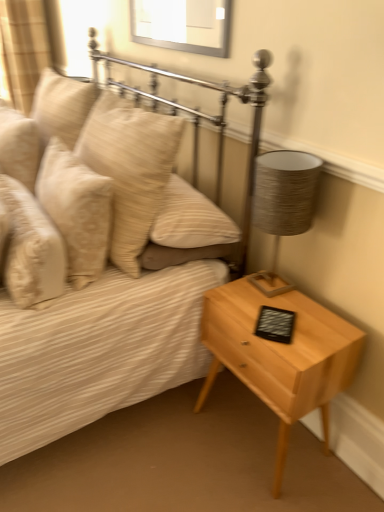
Find the location of a particular element. The image size is (384, 512). light wood/texture nightstand at lower right is located at coordinates (280, 355).

Identify the location of beige textured pillow at left, which ranks as the 3th pillow in left-to-right order. (76, 210).

Locate an element on the screen. matte beige bed at center is located at coordinates (106, 259).

Find the location of a particular element. beige textured pillow at left, the second pillow in the left-to-right sequence is located at coordinates (31, 249).

Image resolution: width=384 pixels, height=512 pixels. What do you see at coordinates (283, 205) in the screenshot? I see `textured gray lampshade at right` at bounding box center [283, 205].

Find the location of `beige fabric curtain at upper left`. beige fabric curtain at upper left is located at coordinates (23, 49).

Measure the distance between beige textured pillow at left, which is the fourth pillow in right-to-left order, and camera.

1.93 meters.

Identify the location of beige textured pillow at left, acting as the 1th pillow starting from the left. (19, 146).

In order to click on light wood/texture nightstand at lower right in this screenshot , I will do `click(280, 355)`.

Could you tell me if beige textured pillow at left, which is the fourth pillow in right-to-left order, is turned towards beige textured pillow at left, which ranks as the 3th pillow in left-to-right order?

No, beige textured pillow at left, which is the fourth pillow in right-to-left order, does not turn towards beige textured pillow at left, which ranks as the 3th pillow in left-to-right order.

From the image's perspective, which one is positioned higher, beige textured pillow at left, acting as the 1th pillow starting from the left, or beige textured pillow at left, which ranks as the 3th pillow in left-to-right order?

beige textured pillow at left, acting as the 1th pillow starting from the left, appears higher in the image.

Identify the location of the 1st pillow above the beige textured pillow at left, which is the second pillow from right to left (from a real-world perspective). pos(19,146).

Which point is more distant from viewer, (2, 143) or (69, 225)?

The point (2, 143) is farther from the camera.

Is beige textured pillow at left, which is the fourth pillow in right-to-left order, oriented away from beige fabric curtain at upper left?

That's not correct — beige textured pillow at left, which is the fourth pillow in right-to-left order, is not looking away from beige fabric curtain at upper left.

Visually, is beige textured pillow at left, which is the fourth pillow in right-to-left order, positioned to the left or to the right of beige fabric curtain at upper left?

beige textured pillow at left, which is the fourth pillow in right-to-left order, is to the right of beige fabric curtain at upper left.

Does beige textured pillow at left, acting as the 1th pillow starting from the left, have a lesser width compared to beige fabric curtain at upper left?

Correct, the width of beige textured pillow at left, acting as the 1th pillow starting from the left, is less than that of beige fabric curtain at upper left.

Is beige textured pillow at left, acting as the 1th pillow starting from the left, shorter than beige fabric curtain at upper left?

Yes.

Considering the positions of objects textured gray lampshade at right and beige fabric curtain at upper left in the image provided, who is more to the left, textured gray lampshade at right or beige fabric curtain at upper left?

beige fabric curtain at upper left is more to the left.

From the image's perspective, which is above, textured gray lampshade at right or beige fabric curtain at upper left?

beige fabric curtain at upper left, from the image's perspective.

In the scene shown: What's the angular difference between textured gray lampshade at right and beige fabric curtain at upper left's facing directions?

There is a 92.4-degree angle between the facing directions of textured gray lampshade at right and beige fabric curtain at upper left.

How much distance is there between textured gray lampshade at right and beige fabric curtain at upper left?

A distance of 8.01 feet exists between textured gray lampshade at right and beige fabric curtain at upper left.

Are light wood/texture nightstand at lower right and beige textured pillow at left, the second pillow in the left-to-right sequence, beside each other?

No, light wood/texture nightstand at lower right is not touching beige textured pillow at left, the second pillow in the left-to-right sequence.

Is light wood/texture nightstand at lower right surrounding beige textured pillow at left, which is the 3th pillow in right-to-left order?

Actually, beige textured pillow at left, which is the 3th pillow in right-to-left order, is outside light wood/texture nightstand at lower right.

Which point is more distant from viewer, (211,367) or (14,179)?

Positioned behind is point (14,179).

Looking at their sizes, would you say light wood/texture nightstand at lower right is wider or thinner than beige textured pillow at left, which is the 3th pillow in right-to-left order?

In the image, light wood/texture nightstand at lower right appears to be wider than beige textured pillow at left, which is the 3th pillow in right-to-left order.

Is beige textured pillow at left, the second pillow in the left-to-right sequence, completely or partially outside of textured gray lampshade at right?

That's correct, beige textured pillow at left, the second pillow in the left-to-right sequence, is outside of textured gray lampshade at right.

Between beige textured pillow at left, the second pillow in the left-to-right sequence, and textured gray lampshade at right, which one is positioned behind?

textured gray lampshade at right is further from the camera.

Consider the image. Is beige textured pillow at left, the second pillow in the left-to-right sequence, oriented away from textured gray lampshade at right?

Yes, beige textured pillow at left, the second pillow in the left-to-right sequence, is facing away from textured gray lampshade at right.

How far apart are beige textured pillow at left, which is the 3th pillow in right-to-left order, and textured gray lampshade at right?

A: beige textured pillow at left, which is the 3th pillow in right-to-left order, is 74.74 centimeters away from textured gray lampshade at right.

Which is in front, beige textured pillow at upper left, the first pillow in the right-to-left sequence, or beige textured pillow at left, acting as the 1th pillow starting from the left?

Positioned in front is beige textured pillow at upper left, the first pillow in the right-to-left sequence.

Is beige textured pillow at upper left, arranged as the fourth pillow when viewed from the left, facing towards beige textured pillow at left, acting as the 1th pillow starting from the left?

No, beige textured pillow at upper left, arranged as the fourth pillow when viewed from the left, is not turned towards beige textured pillow at left, acting as the 1th pillow starting from the left.

Would you consider beige textured pillow at upper left, arranged as the fourth pillow when viewed from the left, to be distant from beige textured pillow at left, acting as the 1th pillow starting from the left?

No, beige textured pillow at upper left, arranged as the fourth pillow when viewed from the left, is in close proximity to beige textured pillow at left, acting as the 1th pillow starting from the left.

From a real-world perspective, which object stands above the other?

From a 3D spatial view, textured gray lampshade at right is above.

Is beige textured pillow at left, which ranks as the 3th pillow in left-to-right order, aimed at textured gray lampshade at right?

No, beige textured pillow at left, which ranks as the 3th pillow in left-to-right order, is not turned towards textured gray lampshade at right.

Which object is positioned more to the right, beige textured pillow at left, which ranks as the 3th pillow in left-to-right order, or textured gray lampshade at right?

textured gray lampshade at right is more to the right.

Locate an element on the screen. This screenshot has width=384, height=512. the 2nd pillow counting from the right of the beige textured pillow at left, which is the fourth pillow in right-to-left order is located at coordinates (76, 210).

From the image's perspective, starting from the beige fabric curtain at upper left, which pillow is the 1st one below? Please provide its 2D coordinates.

[(19, 146)]

Looking at the image, which one is located closer to beige textured pillow at left, which is the fourth pillow in right-to-left order, light wood/texture nightstand at lower right or beige fabric curtain at upper left?

The object closer to beige textured pillow at left, which is the fourth pillow in right-to-left order, is beige fabric curtain at upper left.

Estimate the real-world distances between objects in this image. Which object is closer to beige textured pillow at left, which is the 3th pillow in right-to-left order, beige textured pillow at upper left, the first pillow in the right-to-left sequence, or textured gray lampshade at right?

Based on the image, beige textured pillow at upper left, the first pillow in the right-to-left sequence, appears to be nearer to beige textured pillow at left, which is the 3th pillow in right-to-left order.

Based on their spatial positions, is beige fabric curtain at upper left or light wood/texture nightstand at lower right closer to beige textured pillow at left, the second pillow in the left-to-right sequence?

The object closer to beige textured pillow at left, the second pillow in the left-to-right sequence, is light wood/texture nightstand at lower right.

Which object lies nearer to the anchor point beige fabric curtain at upper left, beige textured pillow at upper left, arranged as the fourth pillow when viewed from the left, or textured gray lampshade at right?

The object closer to beige fabric curtain at upper left is beige textured pillow at upper left, arranged as the fourth pillow when viewed from the left.

From the image, which object appears to be farther from beige textured pillow at upper left, arranged as the fourth pillow when viewed from the left, light wood/texture nightstand at lower right or beige textured pillow at left, which is the fourth pillow in right-to-left order?

light wood/texture nightstand at lower right is further to beige textured pillow at upper left, arranged as the fourth pillow when viewed from the left.

Estimate the real-world distances between objects in this image. Which object is closer to beige textured pillow at left, acting as the 1th pillow starting from the left, matte beige bed at center or textured gray lampshade at right?

The object closer to beige textured pillow at left, acting as the 1th pillow starting from the left, is matte beige bed at center.

Estimate the real-world distances between objects in this image. Which object is further from matte beige bed at center, beige textured pillow at left, which ranks as the 3th pillow in left-to-right order, or light wood/texture nightstand at lower right?

The object further to matte beige bed at center is light wood/texture nightstand at lower right.

Estimate the real-world distances between objects in this image. Which object is closer to textured gray lampshade at right, beige textured pillow at upper left, the first pillow in the right-to-left sequence, or beige textured pillow at left, which is the second pillow from right to left?

beige textured pillow at upper left, the first pillow in the right-to-left sequence, lies closer to textured gray lampshade at right than the other object.

Where is `nightstand between beige textured pillow at left, which is the fourth pillow in right-to-left order, and textured gray lampshade at right, in the horizontal direction`? nightstand between beige textured pillow at left, which is the fourth pillow in right-to-left order, and textured gray lampshade at right, in the horizontal direction is located at coordinates (280, 355).

Image resolution: width=384 pixels, height=512 pixels. I want to click on lamp between beige fabric curtain at upper left and light wood/texture nightstand at lower right from top to bottom, so click(283, 205).

Locate an element on the screen. Image resolution: width=384 pixels, height=512 pixels. bed located between beige textured pillow at left, which is the fourth pillow in right-to-left order, and textured gray lampshade at right in the left-right direction is located at coordinates (106, 259).

The width and height of the screenshot is (384, 512). I want to click on lamp located between matte beige bed at center and beige fabric curtain at upper left in the depth direction, so pos(283,205).